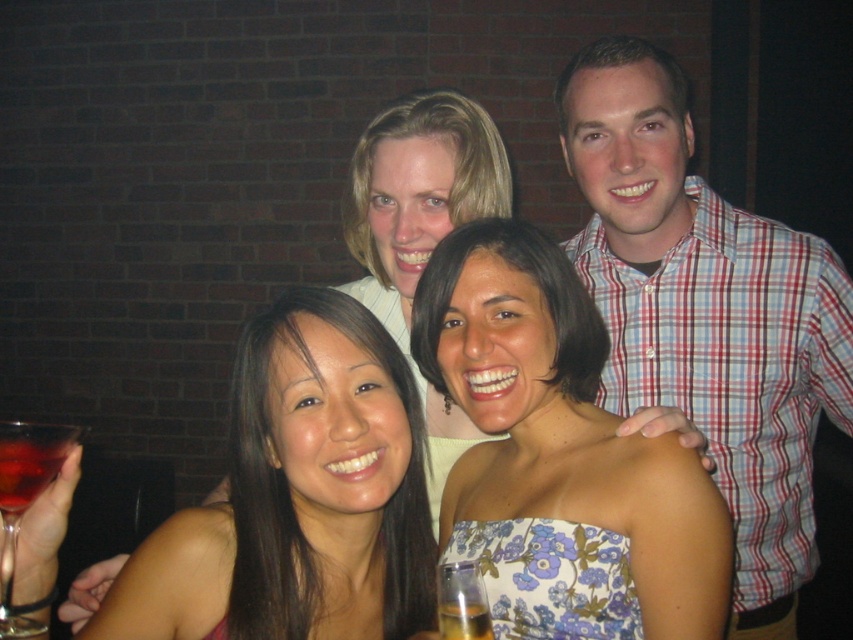
Question: Does translucent glass at lower left come behind translucent glass at lower center?

Choices:
 (A) yes
 (B) no

Answer: (A)

Question: Does plaid shirt at upper right have a greater width compared to translucent glass at lower center?

Choices:
 (A) no
 (B) yes

Answer: (B)

Question: Considering the relative positions of plaid shirt at upper right and translucent glass wine at lower left in the image provided, where is plaid shirt at upper right located with respect to translucent glass wine at lower left?

Choices:
 (A) below
 (B) above

Answer: (B)

Question: Which point is closer to the camera taking this photo?

Choices:
 (A) (53, 432)
 (B) (541, 456)
 (C) (251, 628)
 (D) (482, 612)

Answer: (D)

Question: Estimate the real-world distances between objects in this image. Which object is closer to the translucent glass at lower center?

Choices:
 (A) translucent glass at lower left
 (B) translucent amber liquid at lower center
 (C) floral print dress at center
 (D) translucent glass wine at lower left

Answer: (B)

Question: Based on their relative distances, which object is farther from the translucent glass at lower center?

Choices:
 (A) translucent glass at lower left
 (B) floral print dress at center

Answer: (A)